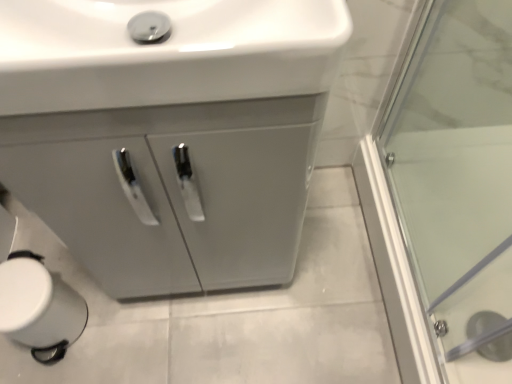
Describe the element at coordinates (168, 134) in the screenshot. Image resolution: width=512 pixels, height=384 pixels. I see `matte gray cabinet at center` at that location.

This screenshot has height=384, width=512. Identify the location of matte gray cabinet at center. (168, 134).

The width and height of the screenshot is (512, 384). What do you see at coordinates (165, 53) in the screenshot?
I see `white glossy sink at upper center` at bounding box center [165, 53].

Where is `white glossy sink at upper center`? white glossy sink at upper center is located at coordinates (165, 53).

Where is `matte gray cabinet at center`? The width and height of the screenshot is (512, 384). matte gray cabinet at center is located at coordinates (168, 134).

Can you confirm if matte gray cabinet at center is positioned to the right of white glossy sink at upper center?

Yes.

Is the position of matte gray cabinet at center less distant than that of white glossy sink at upper center?

No.

Does point (54, 73) come in front of point (94, 102)?

Yes, point (54, 73) is in front of point (94, 102).

From the image's perspective, is matte gray cabinet at center beneath white glossy sink at upper center?

Yes, from the image's perspective, matte gray cabinet at center is beneath white glossy sink at upper center.

From a real-world perspective, is matte gray cabinet at center above or below white glossy sink at upper center?

matte gray cabinet at center is situated lower than white glossy sink at upper center in the real world.

Is matte gray cabinet at center wider or thinner than white glossy sink at upper center?

Clearly, matte gray cabinet at center has more width compared to white glossy sink at upper center.

Can you confirm if matte gray cabinet at center is taller than white glossy sink at upper center?

Yes.

Considering the relative sizes of matte gray cabinet at center and white glossy sink at upper center in the image provided, is matte gray cabinet at center smaller than white glossy sink at upper center?

Incorrect, matte gray cabinet at center is not smaller in size than white glossy sink at upper center.

In the scene shown: Is matte gray cabinet at center inside or outside of white glossy sink at upper center?

matte gray cabinet at center cannot be found inside white glossy sink at upper center.

Would you consider matte gray cabinet at center to be distant from white glossy sink at upper center?

They are positioned close to each other.

Is matte gray cabinet at center aimed at white glossy sink at upper center?

No, matte gray cabinet at center does not turn towards white glossy sink at upper center.

You are a GUI agent. You are given a task and a screenshot of the screen. Output one action in this format:
    pyautogui.click(x=<x>, y=<y>)
    Task: Click on the sink above the matte gray cabinet at center (from a real-world perspective)
    
    Given the screenshot: What is the action you would take?
    pyautogui.click(x=165, y=53)

Does white glossy sink at upper center appear on the left side of matte gray cabinet at center?

Yes.

Who is more distant, white glossy sink at upper center or matte gray cabinet at center?

matte gray cabinet at center is further from the camera.

Which is in front, point (8, 5) or point (267, 244)?

The point (8, 5) is in front.

From the image's perspective, is white glossy sink at upper center below matte gray cabinet at center?

Actually, white glossy sink at upper center appears above matte gray cabinet at center in the image.

From a real-world perspective, is white glossy sink at upper center under matte gray cabinet at center?

Actually, white glossy sink at upper center is physically above matte gray cabinet at center in the real world.

Between white glossy sink at upper center and matte gray cabinet at center, which one has larger width?

matte gray cabinet at center is wider.

From their relative heights in the image, would you say white glossy sink at upper center is taller or shorter than matte gray cabinet at center?

Considering their sizes, white glossy sink at upper center has less height than matte gray cabinet at center.

Is white glossy sink at upper center bigger or smaller than matte gray cabinet at center?

white glossy sink at upper center is smaller than matte gray cabinet at center.

Is matte gray cabinet at center a part of white glossy sink at upper center?

No, matte gray cabinet at center is not inside white glossy sink at upper center.

Is white glossy sink at upper center not close to matte gray cabinet at center?

They are positioned close to each other.

In the scene shown: Could you tell me if white glossy sink at upper center is facing matte gray cabinet at center?

No, white glossy sink at upper center is not aimed at matte gray cabinet at center.

What's the angular difference between white glossy sink at upper center and matte gray cabinet at center's facing directions?

The angle between the facing direction of white glossy sink at upper center and the facing direction of matte gray cabinet at center is 0.271 degrees.

Where is `bathroom cabinet below the white glossy sink at upper center (from the image's perspective)`? The width and height of the screenshot is (512, 384). bathroom cabinet below the white glossy sink at upper center (from the image's perspective) is located at coordinates (168, 134).

At what (x,y) coordinates should I click in order to perform the action: click on sink above the matte gray cabinet at center (from the image's perspective). Please return your answer as a coordinate pair (x, y). This screenshot has height=384, width=512. Looking at the image, I should click on (165, 53).

Where is `sink lying on the left of matte gray cabinet at center`? The image size is (512, 384). sink lying on the left of matte gray cabinet at center is located at coordinates (165, 53).